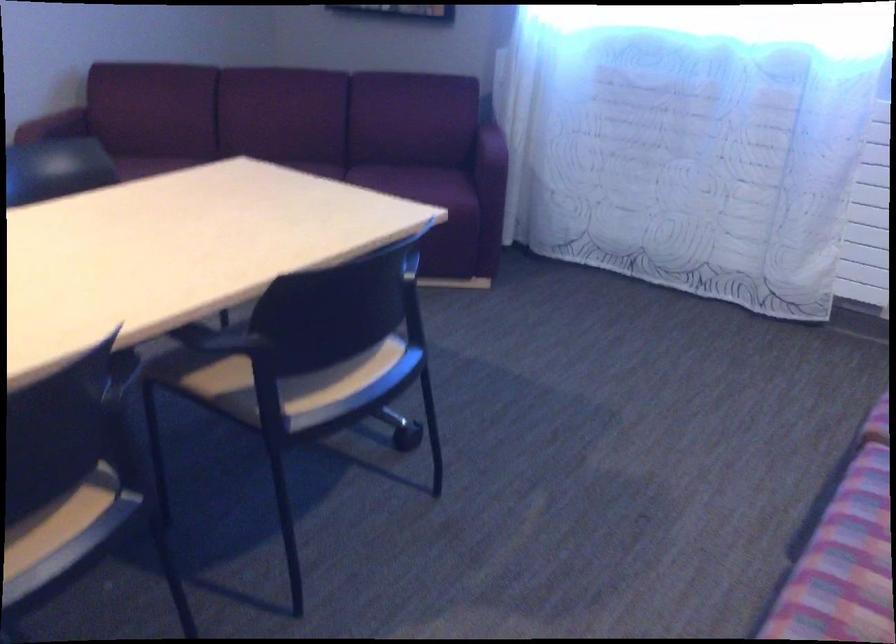
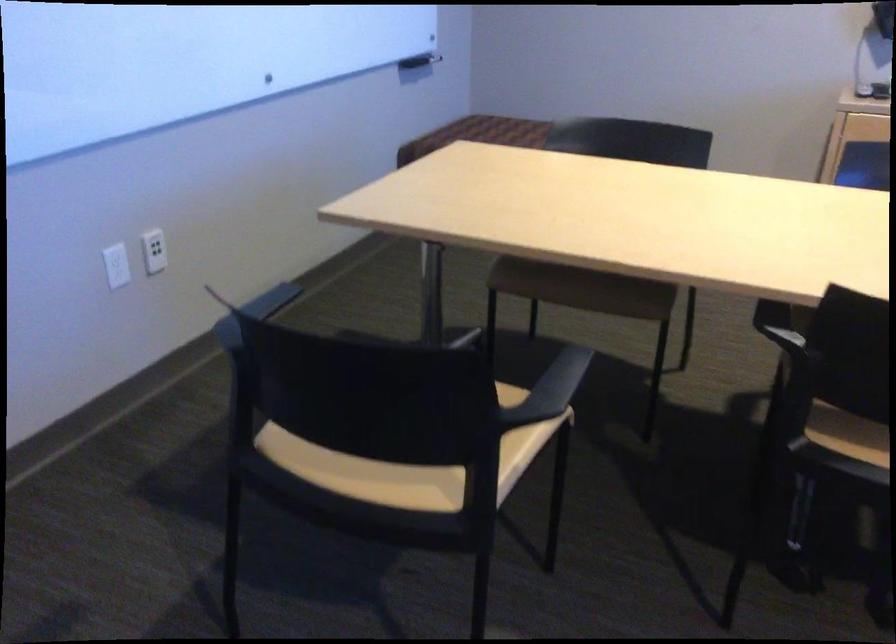
The first image is from the beginning of the video and the second image is from the end. How did the camera likely rotate when shooting the video?

The camera's rotation is toward left-down.